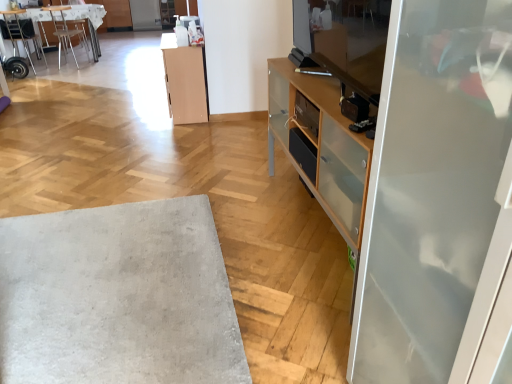
Question: Which direction should I rotate to look at clear glass screen door at upper center, which is the second screen door from bottom to top?

Choices:
 (A) right
 (B) left

Answer: (B)

Question: Is wooden textured desk at upper left positioned before metallic silver chair at upper left, the 2th chair positioned from the right?

Choices:
 (A) yes
 (B) no

Answer: (B)

Question: Is wooden textured desk at upper left next to metallic silver chair at upper left, the first chair viewed from the left?

Choices:
 (A) no
 (B) yes

Answer: (A)

Question: Is the depth of wooden textured desk at upper left greater than that of metallic silver chair at upper left, the first chair viewed from the left?

Choices:
 (A) yes
 (B) no

Answer: (A)

Question: Does wooden textured desk at upper left have a greater height compared to metallic silver chair at upper left, the first chair viewed from the left?

Choices:
 (A) yes
 (B) no

Answer: (B)

Question: From a real-world perspective, is wooden textured desk at upper left physically above metallic silver chair at upper left, the first chair viewed from the left?

Choices:
 (A) no
 (B) yes

Answer: (A)

Question: Would you say wooden textured desk at upper left is a long distance from metallic silver chair at upper left, the 2th chair positioned from the right?

Choices:
 (A) yes
 (B) no

Answer: (B)

Question: Is light wood cabinet at center oriented away from clear glass screen door at upper center, which ranks as the 1th screen door in top-to-bottom order?

Choices:
 (A) no
 (B) yes

Answer: (A)

Question: Considering the relative sizes of light wood cabinet at center and clear glass screen door at upper center, which is the second screen door from bottom to top, in the image provided, is light wood cabinet at center taller than clear glass screen door at upper center, which is the second screen door from bottom to top,?

Choices:
 (A) no
 (B) yes

Answer: (B)

Question: From the image's perspective, is light wood cabinet at center under clear glass screen door at upper center, which is the second screen door in right-to-left order?

Choices:
 (A) yes
 (B) no

Answer: (A)

Question: Does light wood cabinet at center have a larger size compared to clear glass screen door at upper center, which is the second screen door in right-to-left order?

Choices:
 (A) yes
 (B) no

Answer: (B)

Question: From a real-world perspective, is light wood cabinet at center positioned over clear glass screen door at upper center, marked as the 2th screen door in a front-to-back arrangement, based on gravity?

Choices:
 (A) no
 (B) yes

Answer: (B)

Question: Can you confirm if light wood cabinet at center is smaller than clear glass screen door at upper center, which is the 1th screen door in back-to-front order?

Choices:
 (A) no
 (B) yes

Answer: (B)

Question: Can you confirm if clear glass screen door at upper center, which is the second screen door from bottom to top, is bigger than wooden textured desk at upper left?

Choices:
 (A) no
 (B) yes

Answer: (A)